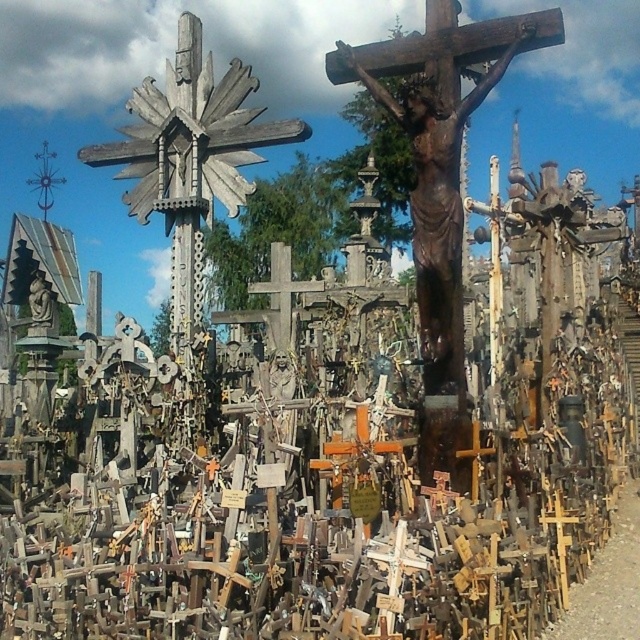
Question: Does wooden crucifix at center come in front of wooden cross at upper left?

Choices:
 (A) no
 (B) yes

Answer: (B)

Question: Which point appears farthest from the camera in this image?

Choices:
 (A) (38, 176)
 (B) (557, 17)

Answer: (A)

Question: Which point is closer to the camera?

Choices:
 (A) (401, 60)
 (B) (44, 166)

Answer: (A)

Question: Is wooden crucifix at center closer to the viewer compared to wooden cross at upper left?

Choices:
 (A) yes
 (B) no

Answer: (A)

Question: Is wooden crucifix at center to the right of wooden cross at upper left from the viewer's perspective?

Choices:
 (A) no
 (B) yes

Answer: (B)